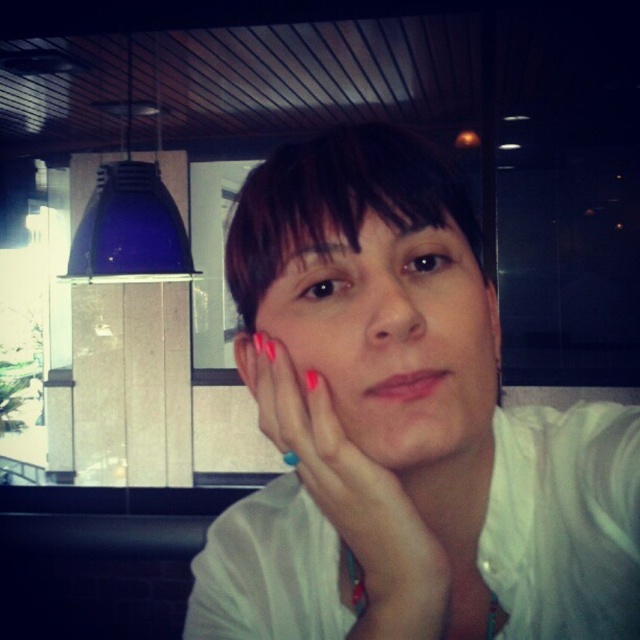
Question: Can you confirm if matte white face at center is wider than pink nail polish at center?

Choices:
 (A) yes
 (B) no

Answer: (A)

Question: Which object is farther from the camera taking this photo?

Choices:
 (A) white matte shirt at center
 (B) pink nail polish at center
 (C) matte white face at center

Answer: (B)

Question: Based on their relative distances, which object is nearer to the pink nail polish at center?

Choices:
 (A) white matte shirt at center
 (B) matte white face at center

Answer: (B)

Question: Is white matte shirt at center wider than matte white face at center?

Choices:
 (A) yes
 (B) no

Answer: (A)

Question: Which of these objects is positioned closest to the matte white face at center?

Choices:
 (A) pink nail polish at center
 (B) white matte shirt at center

Answer: (B)

Question: Is matte white face at center smaller than pink nail polish at center?

Choices:
 (A) yes
 (B) no

Answer: (B)